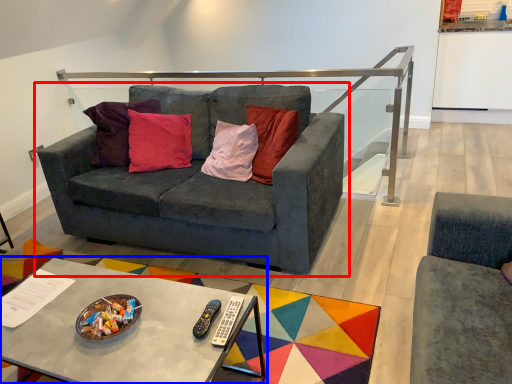
Question: Which object is closer to the camera taking this photo, studio couch (highlighted by a red box) or coffee table (highlighted by a blue box)?

Choices:
 (A) studio couch
 (B) coffee table

Answer: (B)